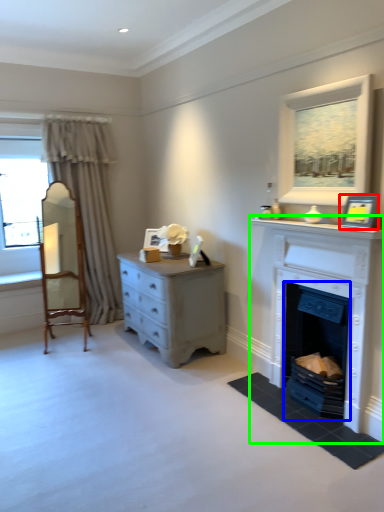
Question: Which object is the closest to the picture frame (highlighted by a red box)? Choose among these: fireplace (highlighted by a blue box) or fireplace (highlighted by a green box).

Choices:
 (A) fireplace
 (B) fireplace

Answer: (B)